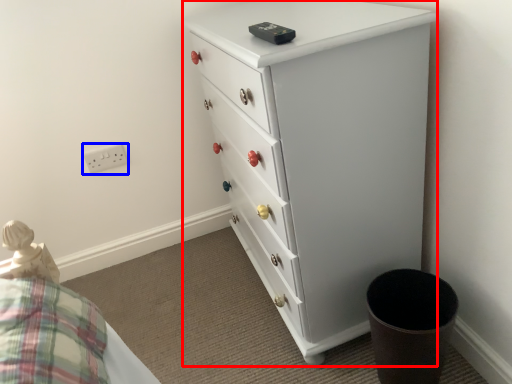
Question: Which object is further to the camera taking this photo, chest of drawers (highlighted by a red box) or electric outlet (highlighted by a blue box)?

Choices:
 (A) chest of drawers
 (B) electric outlet

Answer: (B)